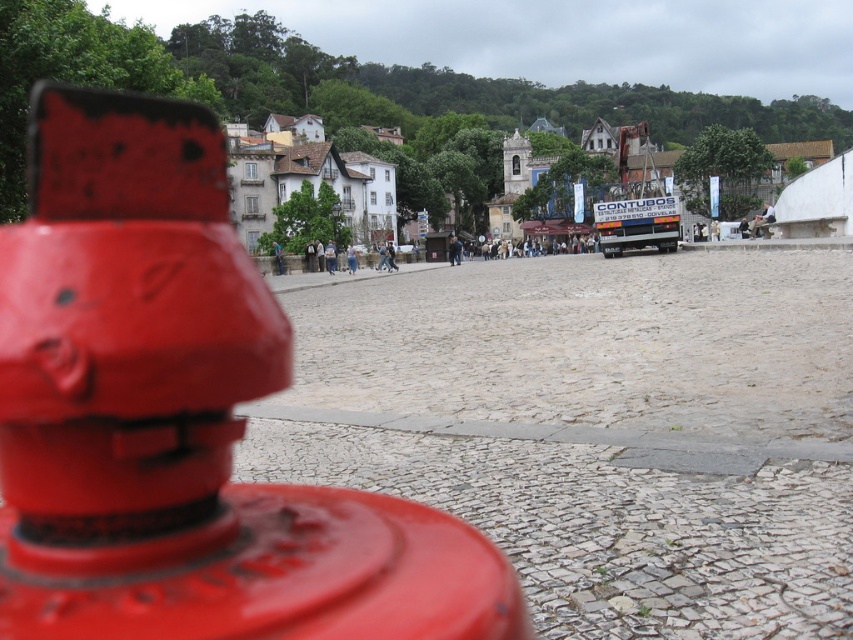
You are a photographer standing at the edge of the cobblestone plaza. You want to take a photo that includes both the matte red hydrant at center and the white stone buildings at center. Considering the distance between them, will you need to adjust your camera settings to focus on both objects simultaneously?

The matte red hydrant at center is 81.35 meters away from the white stone buildings at center. To capture both in focus, you would need to adjust your camera settings to a smaller aperture for a greater depth of field, as the distance between them is significant.

You are a photographer standing in the urban scene and want to take a picture of both the red fire hydrant in the foreground and the buildings in the midground. You notice two points marked in the image at coordinates point (260, 618) and point (480, 186). Which point is closer to you, the photographer?

Point (260, 618) is closer to the camera than point (480, 186).

You are a city planner analyzing the image. You need to determine which object takes up more area in the image between the matte red hydrant at center and the white stone buildings at center. Which one is larger in terms of visual area?

The white stone buildings at center occupy more visual area than the matte red hydrant at center, as the matte red hydrant at center occupies less space than white stone buildings at center.